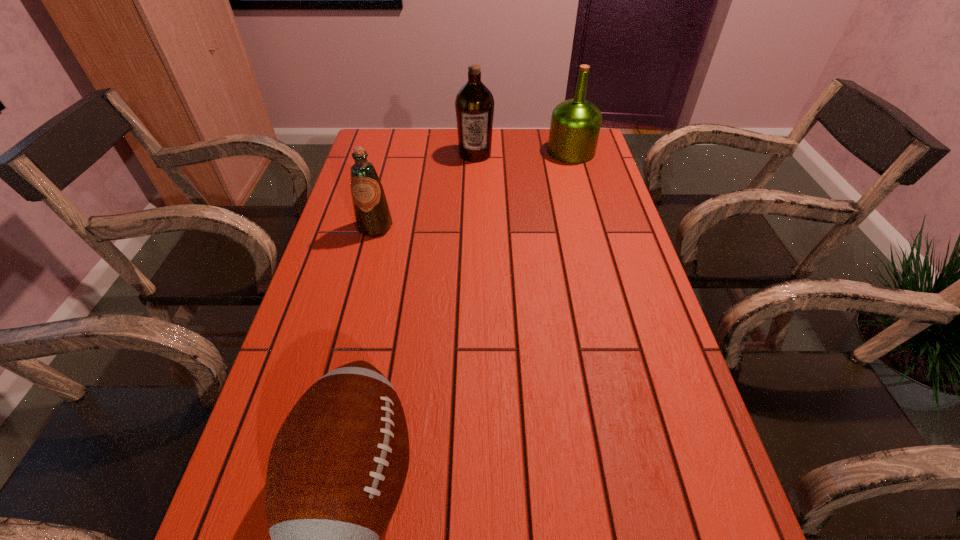
This screenshot has width=960, height=540. I want to click on the third object from left to right, so click(x=474, y=105).

This screenshot has height=540, width=960. Find the location of `the rightmost object`. the rightmost object is located at coordinates (575, 125).

This screenshot has width=960, height=540. What are the coordinates of `the shortest olive oil` in the screenshot? It's located at (371, 211).

Identify the location of the third farthest object. Image resolution: width=960 pixels, height=540 pixels. (371, 211).

Where is `vacant region located on the label of the second object from right to left`? Image resolution: width=960 pixels, height=540 pixels. vacant region located on the label of the second object from right to left is located at coordinates (474, 244).

In order to click on vacant space located on the front of the rightmost object in this screenshot , I will do `click(596, 241)`.

The height and width of the screenshot is (540, 960). I want to click on vacant space located 0.140m on the front-facing side of the nearest olive oil, so click(362, 276).

At what (x,y) coordinates should I click in order to perform the action: click on object that is at the left edge. Please return your answer as a coordinate pair (x, y). Looking at the image, I should click on (371, 211).

I want to click on object located at the right edge, so click(x=575, y=125).

This screenshot has height=540, width=960. In order to click on object positioned at the far right corner in this screenshot , I will do `click(575, 125)`.